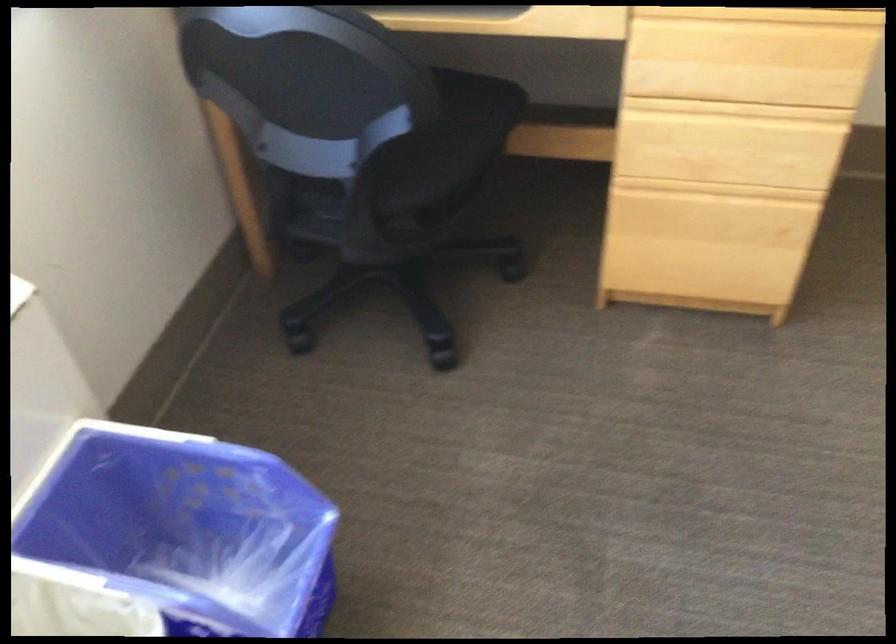
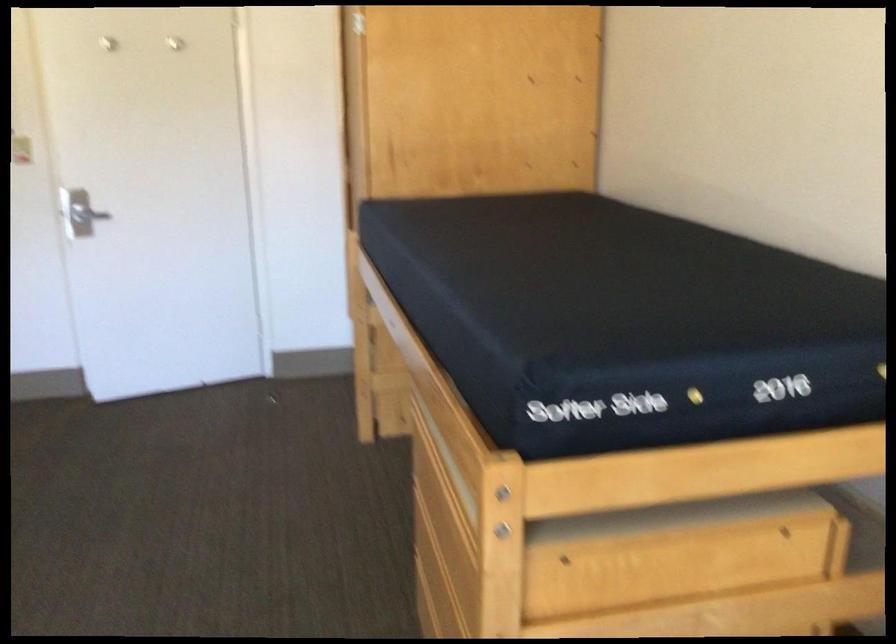
First-person continuous shooting, in which direction is the camera rotating?

The rotation direction of the camera is right-down.